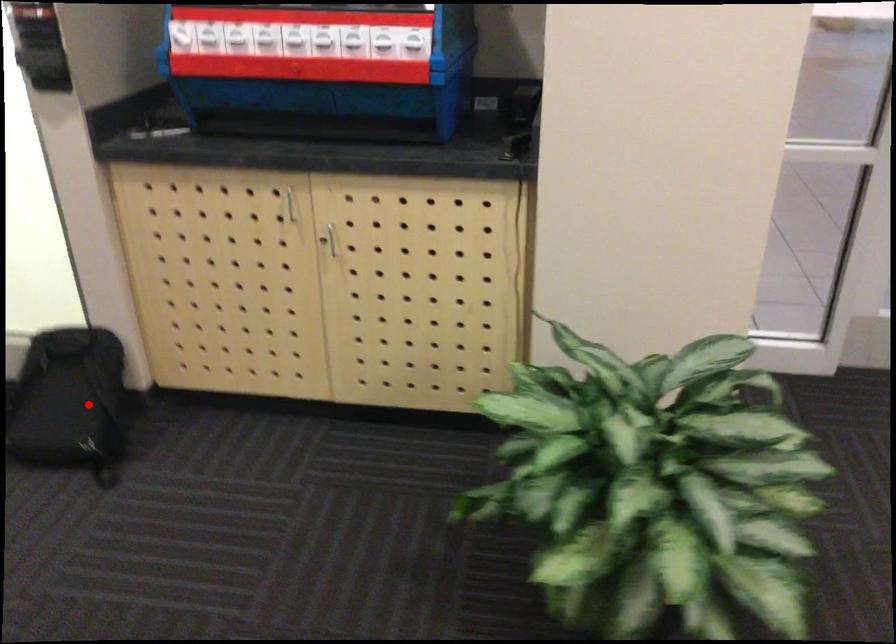
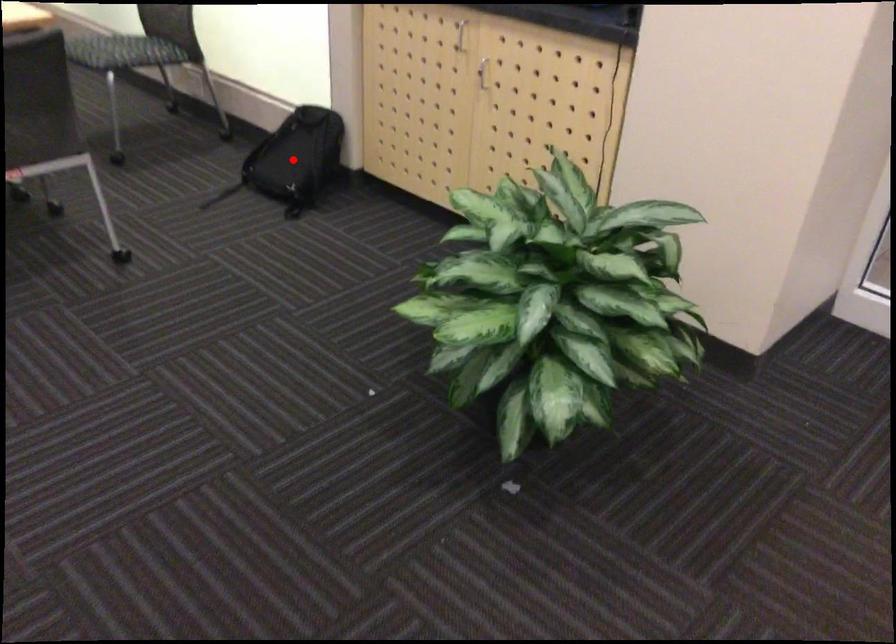
I am providing you with two images of the same scene from different viewpoints. A red point is marked on the first image and another point is marked on the second image. Does the point marked in image1 correspond to the same location as the one in image2?

Yes